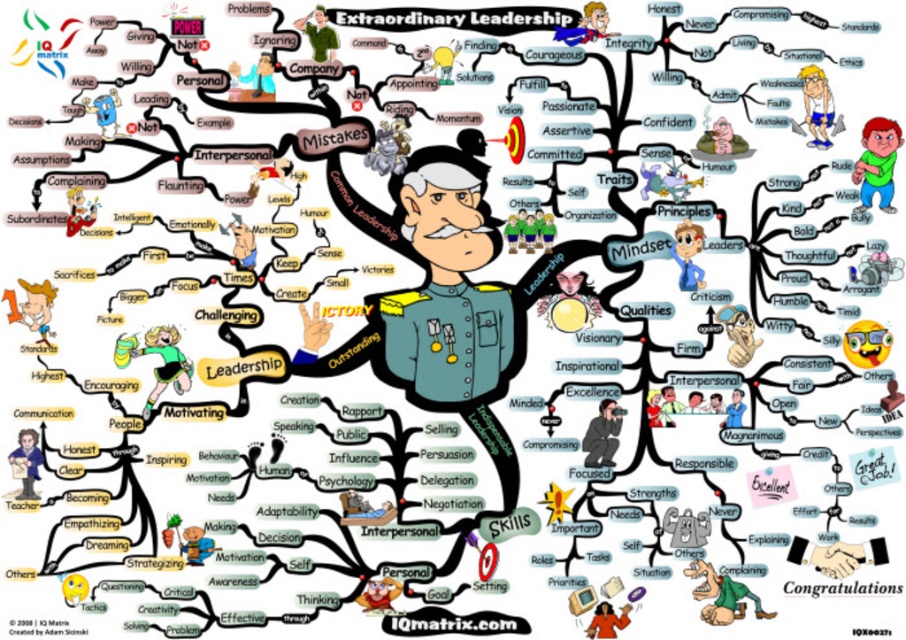
Question: Which point is farther to the camera?

Choices:
 (A) blue shirt at center
 (B) shiny gold helmet at upper right

Answer: (A)

Question: Is matte black figure at center thinner than blue shirt at center?

Choices:
 (A) yes
 (B) no

Answer: (B)

Question: Considering the real-world distances, which object is closest to the green rubber toy at upper right?

Choices:
 (A) shiny gold helmet at upper right
 (B) blue shirt at center
 (C) green fabric figure at lower left

Answer: (A)

Question: Which object is positioned farthest from the matte yellow figure at center?

Choices:
 (A) green rubber toy at upper right
 (B) matte black figure at center

Answer: (A)

Question: Where is matte black figure at center located in relation to matte yellow figure at center in the image?

Choices:
 (A) above
 (B) below

Answer: (B)

Question: Can you confirm if green rubber toy at upper right is positioned to the left of blue shirt at center?

Choices:
 (A) no
 (B) yes

Answer: (A)